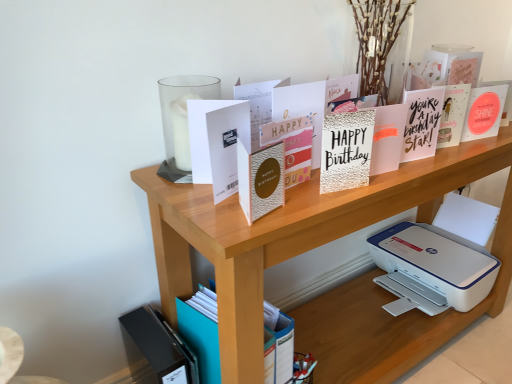
Image resolution: width=512 pixels, height=384 pixels. I want to click on vacant space in front of matte gold card at center, which appears as the 3th paperback book when viewed from the left, so click(x=248, y=232).